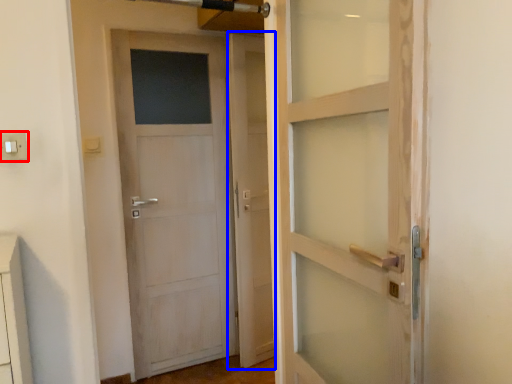
Question: Among these objects, which one is farthest to the camera, electric outlet (highlighted by a red box) or screen door (highlighted by a blue box)?

Choices:
 (A) electric outlet
 (B) screen door

Answer: (B)